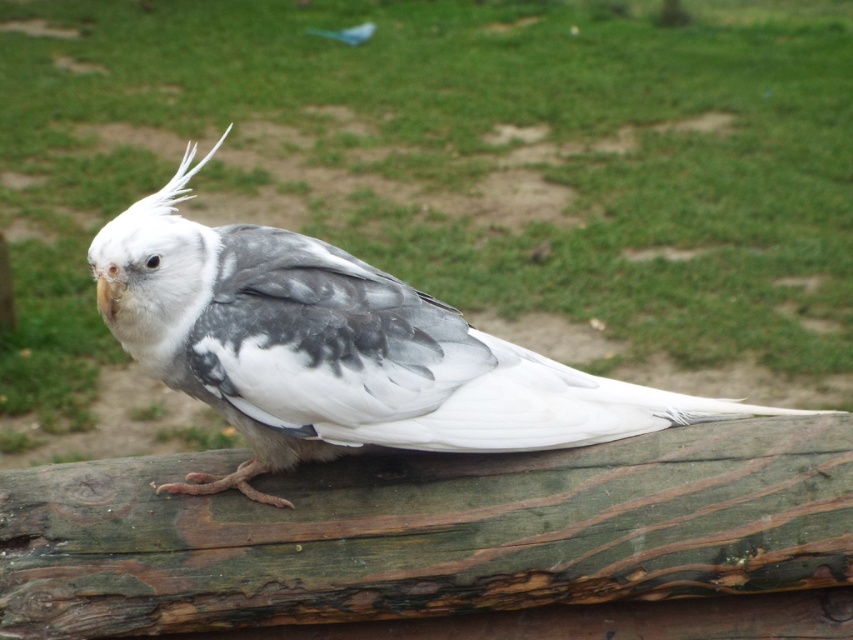
Question: Is weathered wood at center to the left of white matte bird at center from the viewer's perspective?

Choices:
 (A) yes
 (B) no

Answer: (A)

Question: Which point is closer to the camera?

Choices:
 (A) weathered wood at center
 (B) white matte bird at center

Answer: (B)

Question: Which of the following is the closest to the observer?

Choices:
 (A) (122, 330)
 (B) (198, 618)

Answer: (A)

Question: Considering the relative positions of weathered wood at center and white matte bird at center in the image provided, where is weathered wood at center located with respect to white matte bird at center?

Choices:
 (A) above
 (B) below

Answer: (B)

Question: Does weathered wood at center have a larger size compared to white matte bird at center?

Choices:
 (A) no
 (B) yes

Answer: (A)